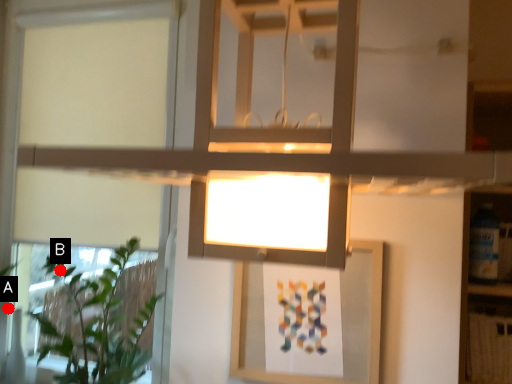
Question: Two points are circled on the image, labeled by A and B beside each circle. Which point appears closest to the camera in this image?

Choices:
 (A) A is closer
 (B) B is closer

Answer: (B)